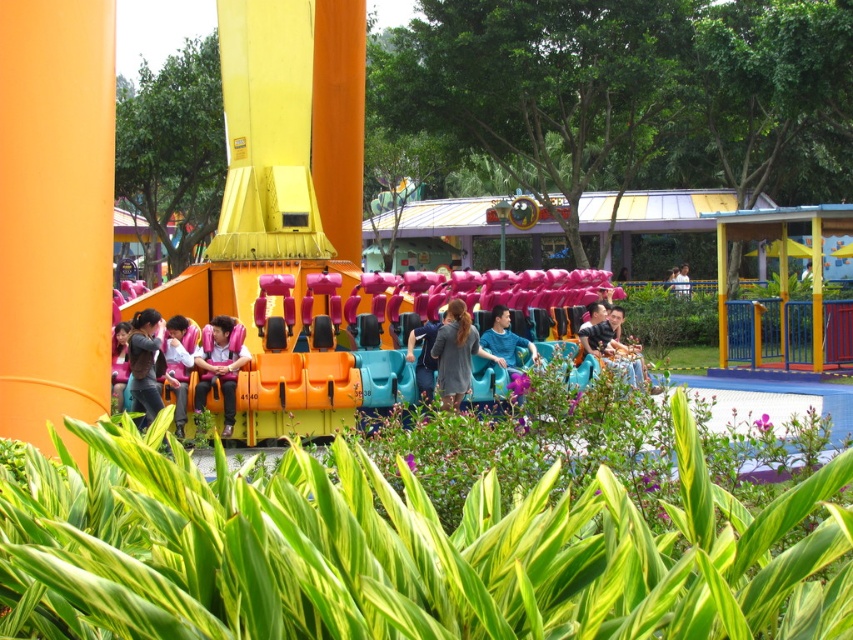
You are a photographer standing in the amusement park garden. You want to take a photo of the gray fabric dress at center and the matte orange seat at center such that the dress is to the right of the seat in the frame. Is this possible based on their current positions?

The gray fabric dress at center is positioned on the right side of the matte orange seat at center, so yes, the photographer can frame the photo to show the gray fabric dress at center to the right of the matte orange seat at center.

You are standing in the amusement park and see the gray fabric dress at center and the matte black shirt at left. Which one is closer to you?

The gray fabric dress at center is closer to you because it is further to the viewer than the matte black shirt at left.